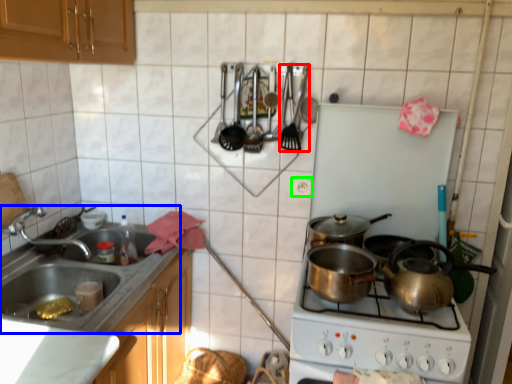
Question: Estimate the real-world distances between objects in this image. Which object is closer to silverware (highlighted by a red box), sink (highlighted by a blue box) or electric outlet (highlighted by a green box)?

Choices:
 (A) sink
 (B) electric outlet

Answer: (B)